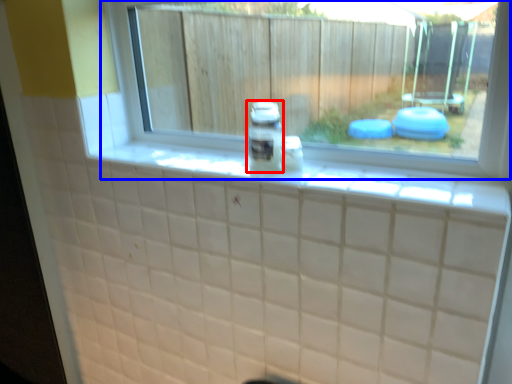
Question: Which of the following is the farthest to the observer, glass jar (highlighted by a red box) or window (highlighted by a blue box)?

Choices:
 (A) glass jar
 (B) window

Answer: (A)